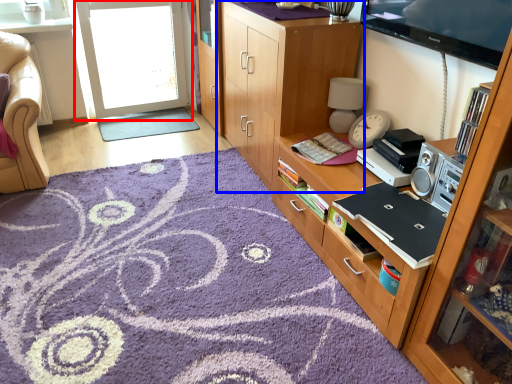
Question: Which object appears farthest to the camera in this image, screen door (highlighted by a red box) or cabinetry (highlighted by a blue box)?

Choices:
 (A) screen door
 (B) cabinetry

Answer: (A)